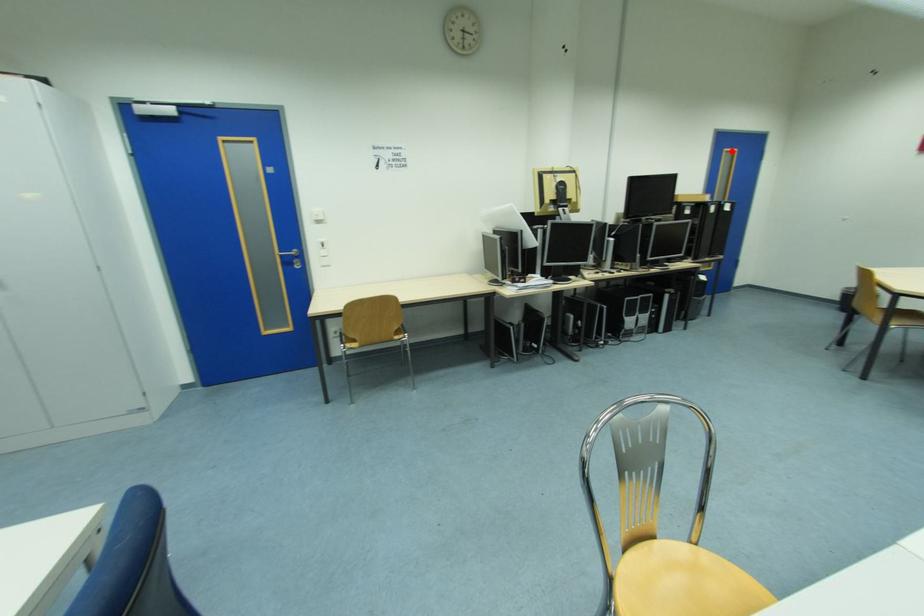
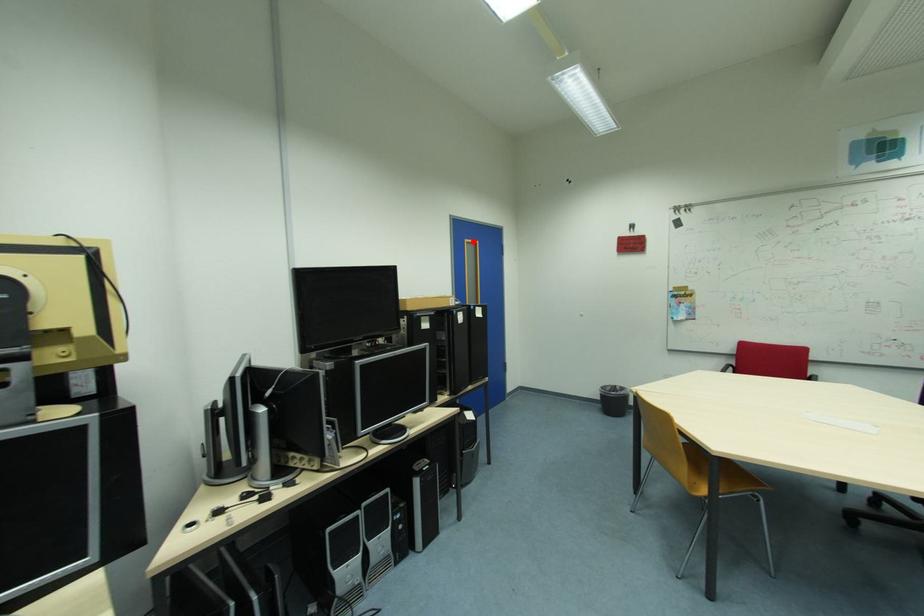
I am providing you with two images of the same scene from different viewpoints. A red point is marked on the first image and another point is marked on the second image. Does the point marked in image1 correspond to the same location as the one in image2?

Yes